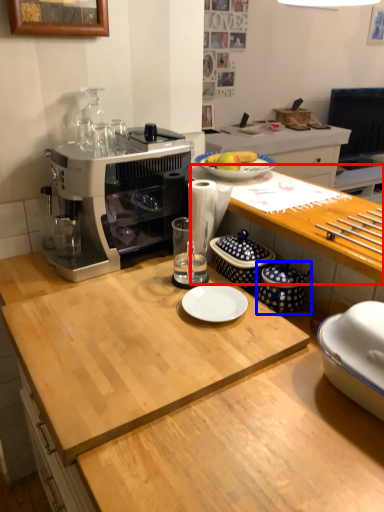
Question: Which object appears farthest to the camera in this image, desk (highlighted by a red box) or appliance (highlighted by a blue box)?

Choices:
 (A) desk
 (B) appliance

Answer: (B)